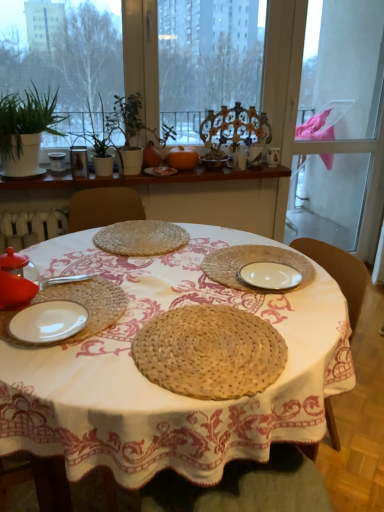
Find the location of a particular element. The height and width of the screenshot is (512, 384). empty space that is to the right of white matte plate at lower left, placed as the 5th plate when sorted from back to front is located at coordinates (182, 315).